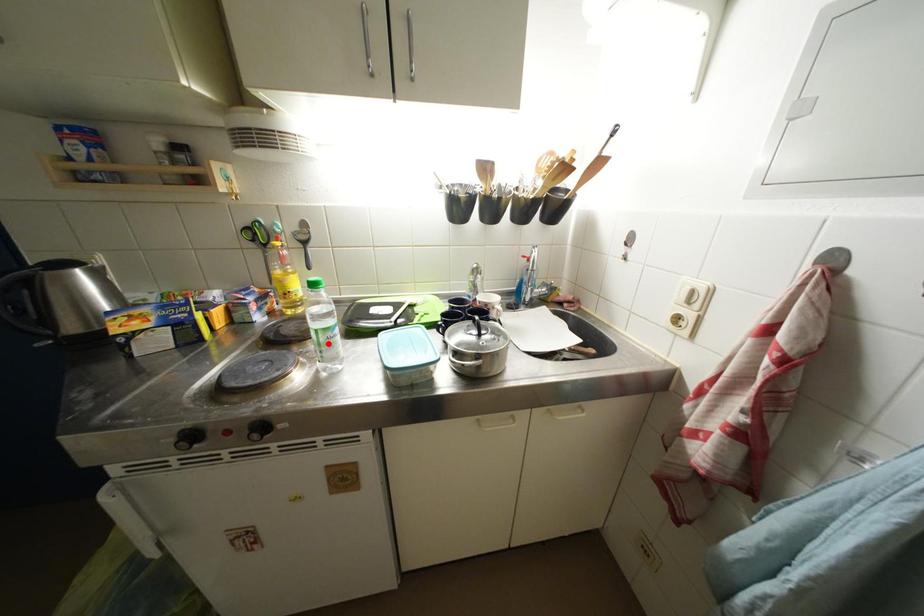
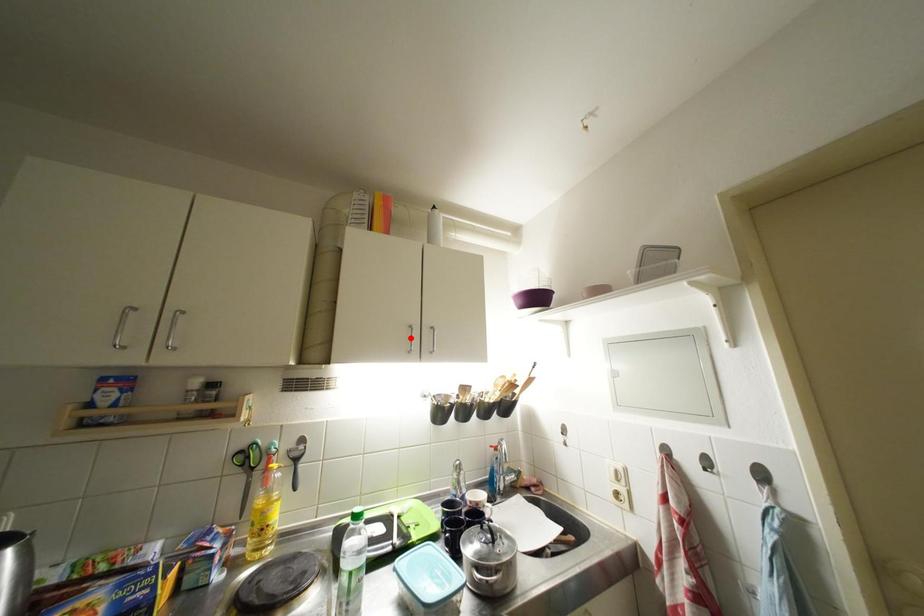
I am providing you with two images of the same scene from different viewpoints. A red point is marked on the first image and another point is marked on the second image. Do the highlighted points in image1 and image2 indicate the same real-world spot?

No